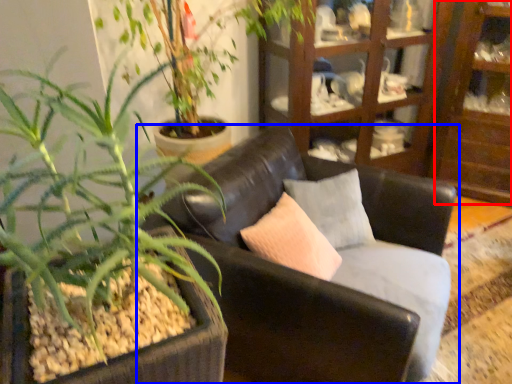
Question: Which of the following is the farthest to the observer, shelf (highlighted by a red box) or chair (highlighted by a blue box)?

Choices:
 (A) shelf
 (B) chair

Answer: (A)